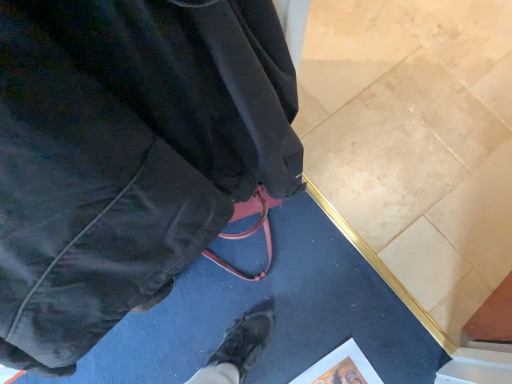
Question: Considering their positions, is matte black jacket at center located in front of or behind orange matte paper at lower center?

Choices:
 (A) behind
 (B) front

Answer: (B)

Question: From a real-world perspective, is matte black jacket at center positioned above or below orange matte paper at lower center?

Choices:
 (A) above
 (B) below

Answer: (A)

Question: In terms of size, does matte black jacket at center appear bigger or smaller than orange matte paper at lower center?

Choices:
 (A) small
 (B) big

Answer: (B)

Question: In terms of height, does orange matte paper at lower center look taller or shorter compared to matte black jacket at center?

Choices:
 (A) short
 (B) tall

Answer: (A)

Question: From the image's perspective, is orange matte paper at lower center located above or below matte black jacket at center?

Choices:
 (A) above
 (B) below

Answer: (B)

Question: From a real-world perspective, is orange matte paper at lower center above or below matte black jacket at center?

Choices:
 (A) above
 (B) below

Answer: (B)

Question: Choose the correct answer: Is orange matte paper at lower center inside matte black jacket at center or outside it?

Choices:
 (A) outside
 (B) inside

Answer: (A)